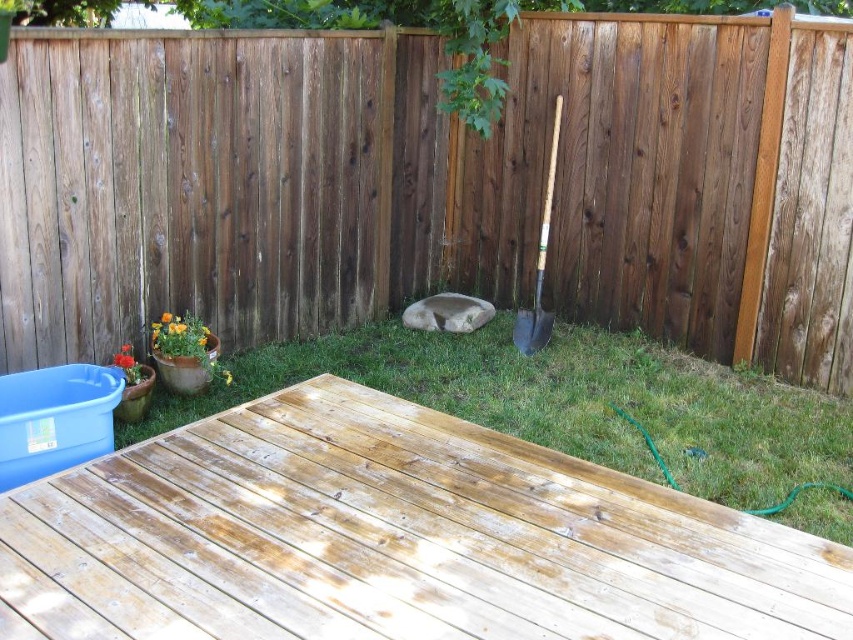
Question: Estimate the real-world distances between objects in this image. Which object is farther from the green grass at center?

Choices:
 (A) wooden handle shovel at center right
 (B) brown wooden fence at upper center
 (C) weathered wood deck at lower left

Answer: (A)

Question: Is brown wooden fence at upper center in front of green grass at center?

Choices:
 (A) yes
 (B) no

Answer: (B)

Question: Which point appears farthest from the camera in this image?

Choices:
 (A) (550, 317)
 (B) (567, 440)
 (C) (820, 250)
 (D) (570, 486)

Answer: (A)

Question: Among these objects, which one is nearest to the camera?

Choices:
 (A) weathered wood deck at lower left
 (B) green grass at center

Answer: (A)

Question: Observing the image, what is the correct spatial positioning of brown wooden fence at upper center in reference to weathered wood deck at lower left?

Choices:
 (A) left
 (B) right

Answer: (B)

Question: Does green grass at center appear on the left side of wooden handle shovel at center right?

Choices:
 (A) yes
 (B) no

Answer: (A)